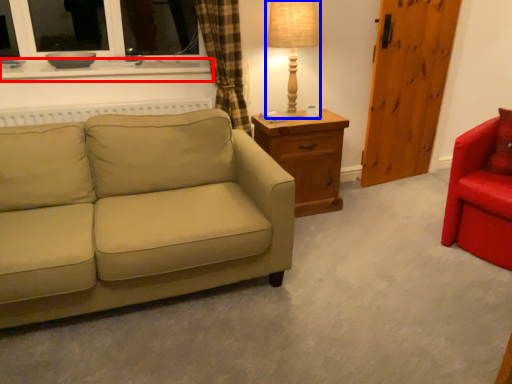
Question: Which point is further to the camera, window sill (highlighted by a red box) or table lamp (highlighted by a blue box)?

Choices:
 (A) window sill
 (B) table lamp

Answer: (B)